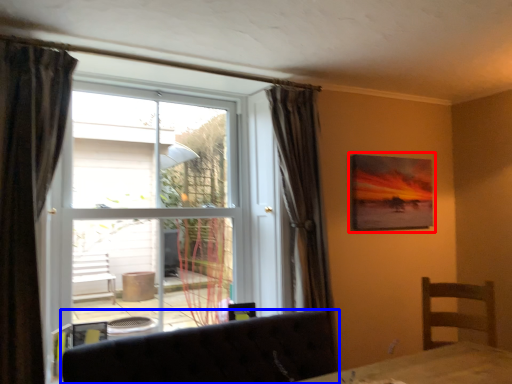
Question: Which of the following is the farthest to the observer, picture frame (highlighted by a red box) or furniture (highlighted by a blue box)?

Choices:
 (A) picture frame
 (B) furniture

Answer: (A)